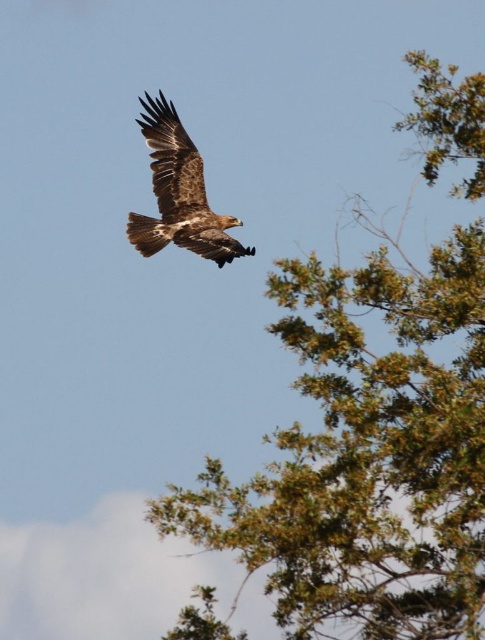
Question: Is green leafy tree at upper right to the left of brown feathered eagle at upper center from the viewer's perspective?

Choices:
 (A) yes
 (B) no

Answer: (B)

Question: Does green leafy tree at upper right appear over brown feathered eagle at upper center?

Choices:
 (A) yes
 (B) no

Answer: (B)

Question: Is green leafy tree at upper right positioned before brown feathered eagle at upper center?

Choices:
 (A) yes
 (B) no

Answer: (A)